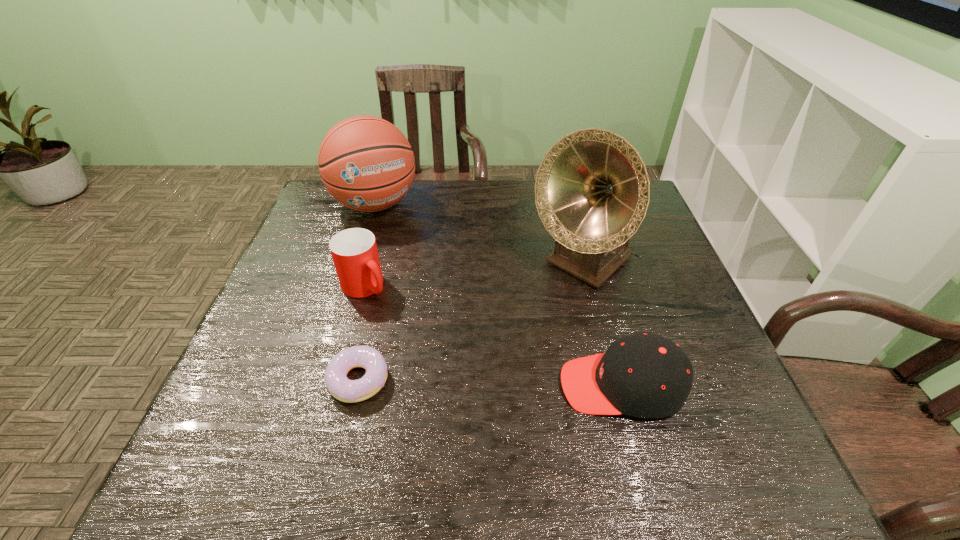
Locate an element on the screen. doughnut that is positioned at the near edge is located at coordinates (343, 389).

Locate an element on the screen. cap at the near edge is located at coordinates (647, 376).

Find the location of a particular element. This screenshot has height=540, width=960. object that is at the left edge is located at coordinates (366, 163).

Find the location of a particular element. cap present at the right edge is located at coordinates click(647, 376).

Locate an element on the screen. phonograph record that is at the right edge is located at coordinates (592, 190).

Where is `object present at the far left corner`? object present at the far left corner is located at coordinates (366, 163).

You are a GUI agent. You are given a task and a screenshot of the screen. Output one action in this format:
    pyautogui.click(x=<x>, y=<y>)
    Task: Click on the object located in the near right corner section of the desktop
    This screenshot has width=960, height=540.
    Given the screenshot: What is the action you would take?
    pyautogui.click(x=647, y=376)

You are a GUI agent. You are given a task and a screenshot of the screen. Output one action in this format:
    pyautogui.click(x=<x>, y=<y>)
    Task: Click on the blank space at the far edge of the desktop
    This screenshot has width=960, height=540.
    Given the screenshot: What is the action you would take?
    pyautogui.click(x=531, y=186)

In the image, there is a desktop. At what (x,y) coordinates should I click in order to perform the action: click on vacant space at the near edge. Please return your answer as a coordinate pair (x, y). The width and height of the screenshot is (960, 540). Looking at the image, I should click on (575, 411).

The image size is (960, 540). Identify the location of vacant space at the left edge of the desktop. (265, 366).